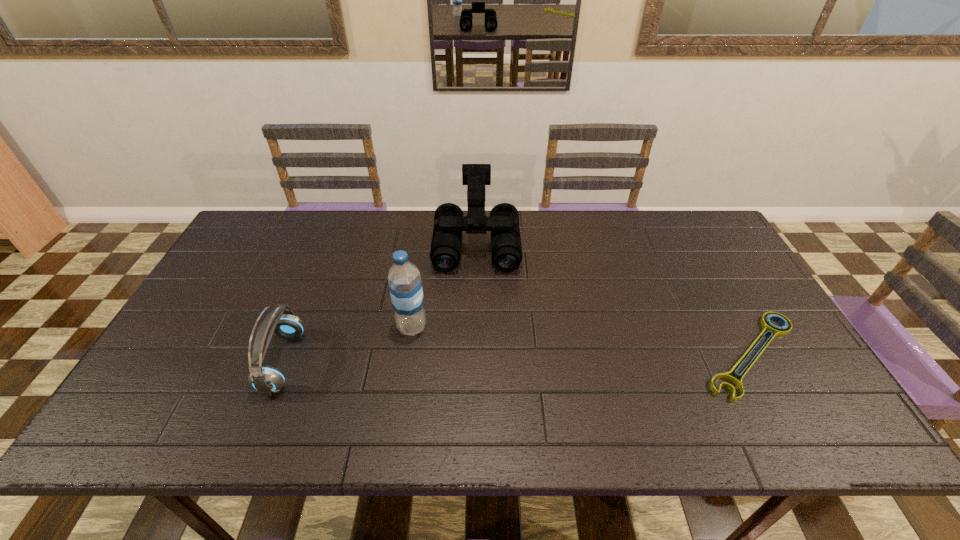
Identify the location of vacant area that lies between the leftmost object and the third shortest object. (380, 302).

You are a GUI agent. You are given a task and a screenshot of the screen. Output one action in this format:
    pyautogui.click(x=<x>, y=<y>)
    Task: Click on the free area in between the wrench and the third shortest object
    This screenshot has height=540, width=960.
    Given the screenshot: What is the action you would take?
    pyautogui.click(x=614, y=299)

At what (x,y) coordinates should I click in order to perform the action: click on empty location between the tallest object and the leftmost object. Please return your answer as a coordinate pair (x, y). Looking at the image, I should click on (348, 345).

Find the location of a particular element. vacant space that is in between the rightmost object and the water bottle is located at coordinates (582, 341).

Identify the location of free space between the leftmost object and the rightmost object. (517, 359).

Image resolution: width=960 pixels, height=540 pixels. Identify the location of vacant area that lies between the tallest object and the headset. (348, 345).

Locate which object is the second closest to the wrench. Please provide its 2D coordinates. Your answer should be formatted as a tuple, i.e. [(x, y)], where the tuple contains the x and y coordinates of a point satisfying the conditions above.

[(405, 285)]

Where is `object that stands as the third closest to the tallest object`? This screenshot has width=960, height=540. object that stands as the third closest to the tallest object is located at coordinates (x=771, y=329).

Where is `vacant space that satisfies the following two spatial constraints: 1. on the front side of the third shortest object; 2. on the right side of the rightmost object`? This screenshot has width=960, height=540. vacant space that satisfies the following two spatial constraints: 1. on the front side of the third shortest object; 2. on the right side of the rightmost object is located at coordinates (475, 355).